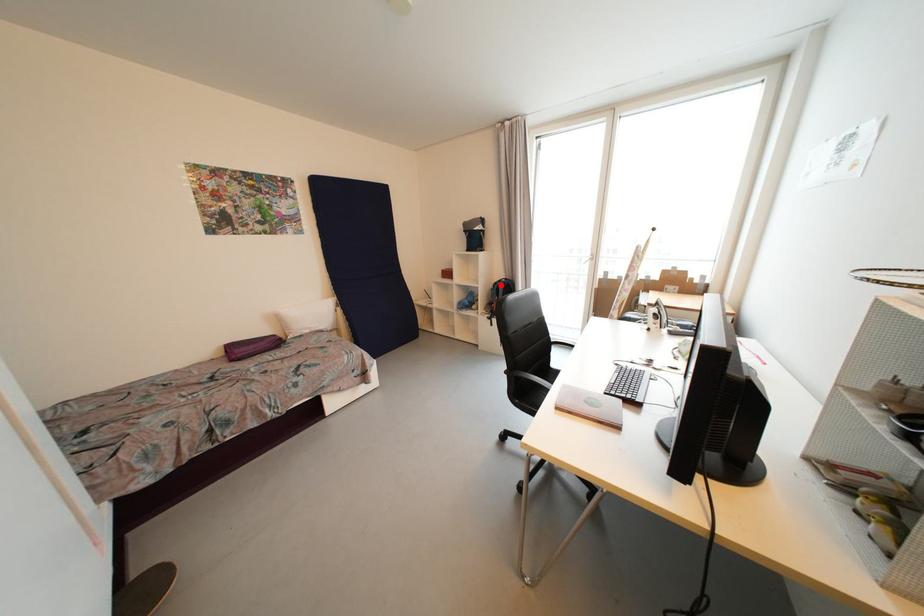
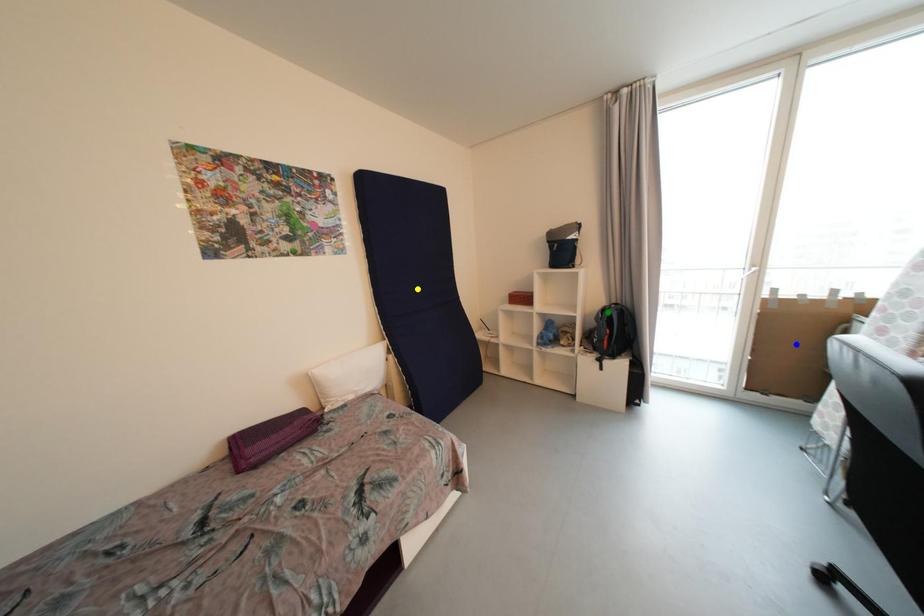
Question: I am providing you with two images of the same scene from different viewpoints. A red point is marked on the first image. You are given multiple points on the second image. In image 2, which mark is for the same physical point as the one in image 1?

Choices:
 (A) green point
 (B) blue point
 (C) yellow point

Answer: (A)